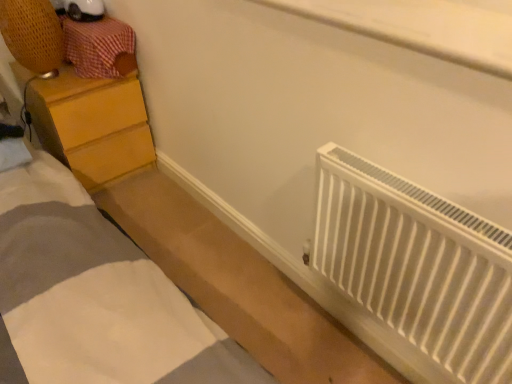
Question: Is white matte bed at lower right further to camera compared to white plastic radiator at lower right?

Choices:
 (A) no
 (B) yes

Answer: (B)

Question: Is white matte bed at lower right wider than white plastic radiator at lower right?

Choices:
 (A) yes
 (B) no

Answer: (A)

Question: Is white matte bed at lower right turned away from white plastic radiator at lower right?

Choices:
 (A) yes
 (B) no

Answer: (B)

Question: From a real-world perspective, is white matte bed at lower right over white plastic radiator at lower right?

Choices:
 (A) yes
 (B) no

Answer: (B)

Question: Considering the relative sizes of white matte bed at lower right and white plastic radiator at lower right in the image provided, is white matte bed at lower right smaller than white plastic radiator at lower right?

Choices:
 (A) no
 (B) yes

Answer: (A)

Question: In terms of size, does white matte bed at lower right appear bigger or smaller than wooden drawer at upper left?

Choices:
 (A) small
 (B) big

Answer: (B)

Question: Is white matte bed at lower right inside or outside of wooden drawer at upper left?

Choices:
 (A) outside
 (B) inside

Answer: (A)

Question: Considering their positions, is white matte bed at lower right located in front of or behind wooden drawer at upper left?

Choices:
 (A) front
 (B) behind

Answer: (A)

Question: Considering the relative positions of white matte bed at lower right and wooden drawer at upper left in the image provided, is white matte bed at lower right to the left or to the right of wooden drawer at upper left?

Choices:
 (A) left
 (B) right

Answer: (B)

Question: Choose the correct answer: Is white matte bed at lower right inside white plastic radiator at lower right or outside it?

Choices:
 (A) outside
 (B) inside

Answer: (A)

Question: Considering the relative positions of white matte bed at lower right and white plastic radiator at lower right in the image provided, is white matte bed at lower right to the left or to the right of white plastic radiator at lower right?

Choices:
 (A) right
 (B) left

Answer: (B)

Question: Relative to white plastic radiator at lower right, is white matte bed at lower right in front or behind?

Choices:
 (A) behind
 (B) front

Answer: (A)

Question: In terms of size, does white matte bed at lower right appear bigger or smaller than white plastic radiator at lower right?

Choices:
 (A) big
 (B) small

Answer: (A)

Question: Considering the positions of point (121, 39) and point (133, 114), is point (121, 39) closer or farther from the camera than point (133, 114)?

Choices:
 (A) farther
 (B) closer

Answer: (B)

Question: Which is correct: wooden drawer at upper left is inside wooden chest of drawers at left, or outside of it?

Choices:
 (A) outside
 (B) inside

Answer: (A)